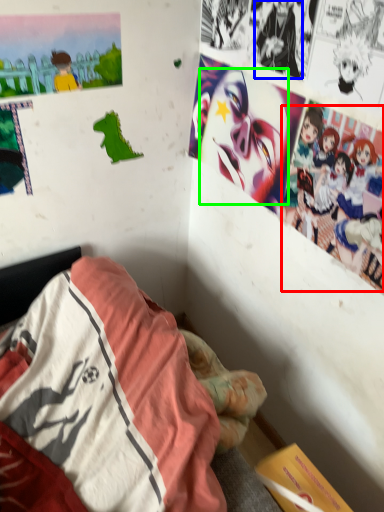
Question: Which object is positioned farthest from person (highlighted by a red box)? Select from person (highlighted by a blue box) and human face (highlighted by a green box).

Choices:
 (A) person
 (B) human face

Answer: (A)